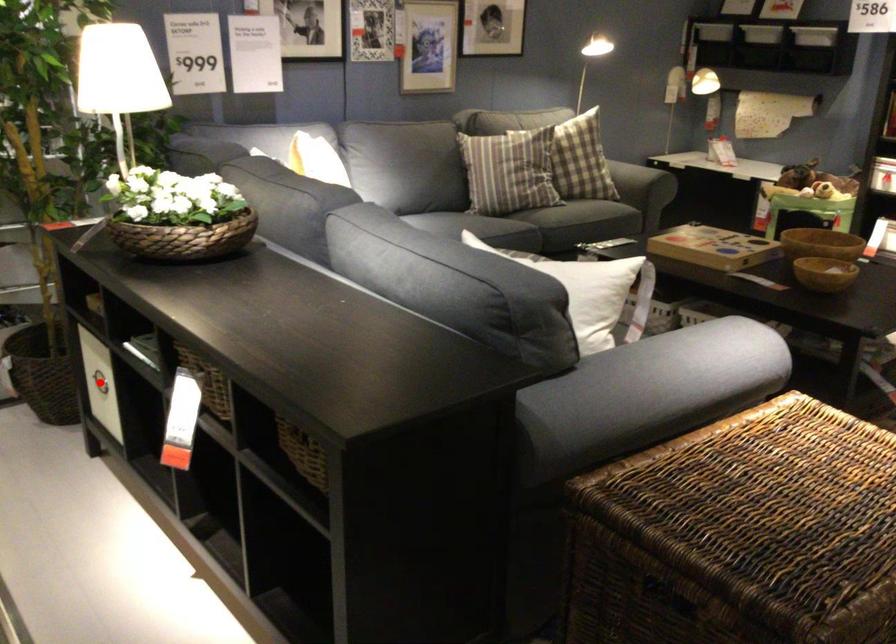
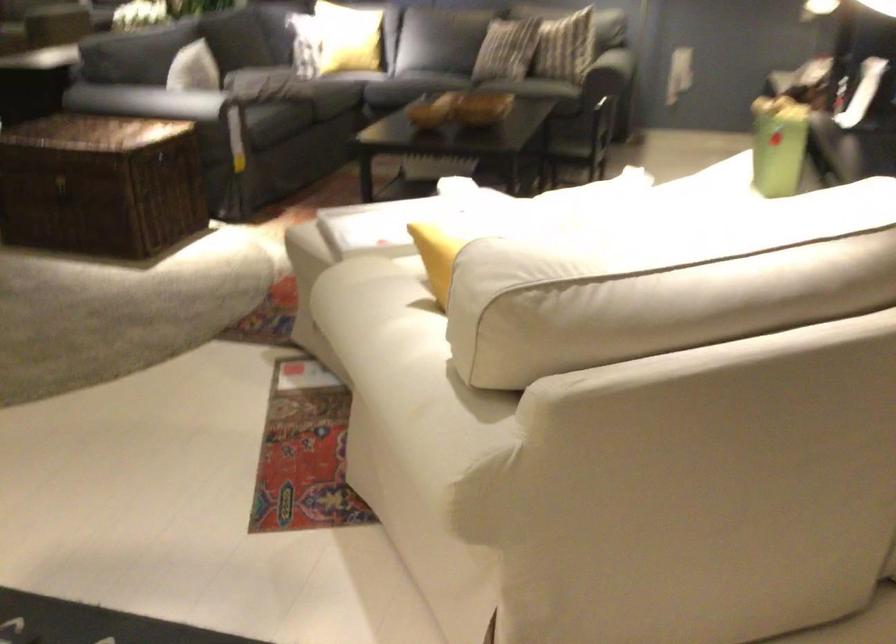
Question: I am providing you with two images of the same scene from different viewpoints. A red point is marked on the first image. At the location where the point appears in image 1, is it still visible in image 2?

Choices:
 (A) Yes
 (B) No

Answer: (B)